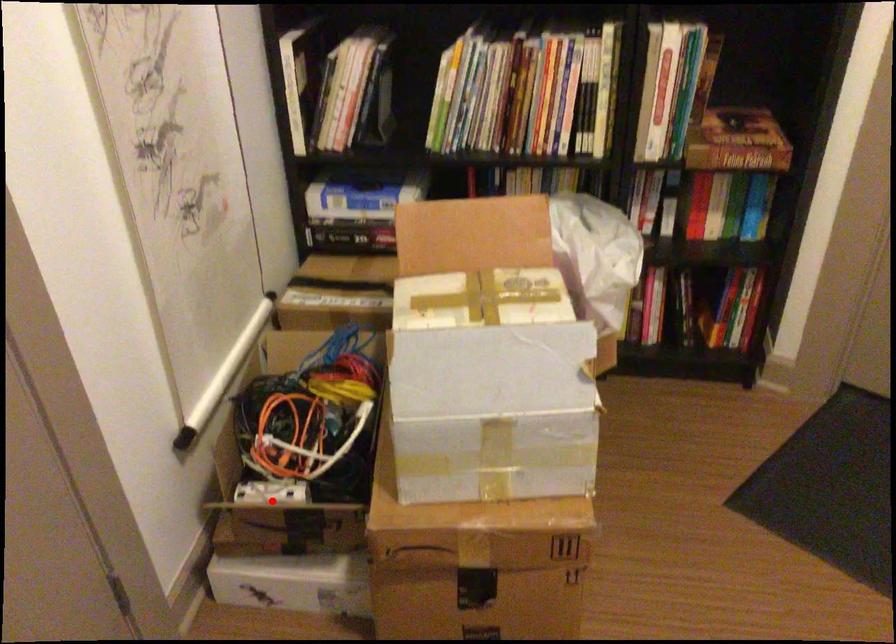
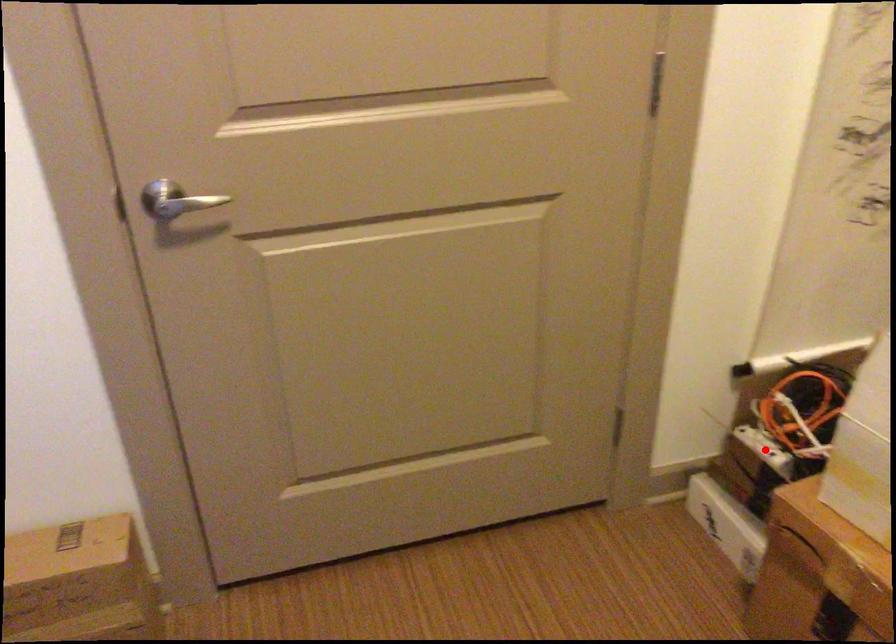
I am providing you with two images of the same scene from different viewpoints. A red point is marked on the first image and another point is marked on the second image. Is the red point in image1 aligned with the point shown in image2?

Yes